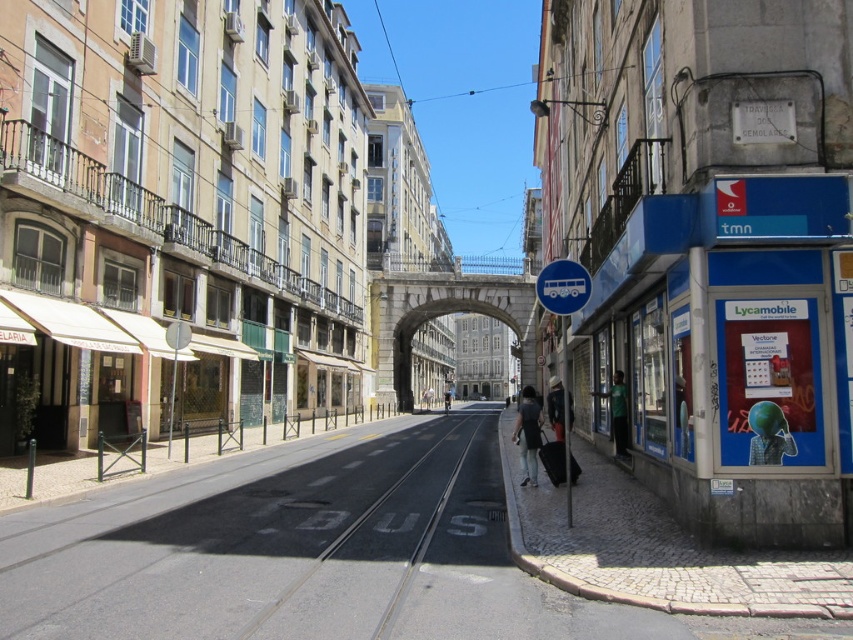
Which is more to the right, black asphalt train track at center or dark gray fabric jacket at center?

dark gray fabric jacket at center

How distant is black asphalt train track at center from dark gray fabric jacket at center?

5.03 meters

Which is behind, point (328, 486) or point (552, 406)?

The point (552, 406) is behind.

Identify the location of black asphalt train track at center. (368, 541).

Consider the image. Which is above, green matte shirt at center or black fabric suitcase at lower center?

green matte shirt at center is above.

Who is positioned more to the right, green matte shirt at center or black fabric suitcase at lower center?

green matte shirt at center

This screenshot has width=853, height=640. Find the location of `green matte shirt at center`. green matte shirt at center is located at coordinates (618, 412).

Who is higher up, black asphalt train track at center or black fabric suitcase at lower center?

black fabric suitcase at lower center is above.

Can you confirm if black asphalt train track at center is positioned above black fabric suitcase at lower center?

No.

Where is `black asphalt train track at center`? black asphalt train track at center is located at coordinates (368, 541).